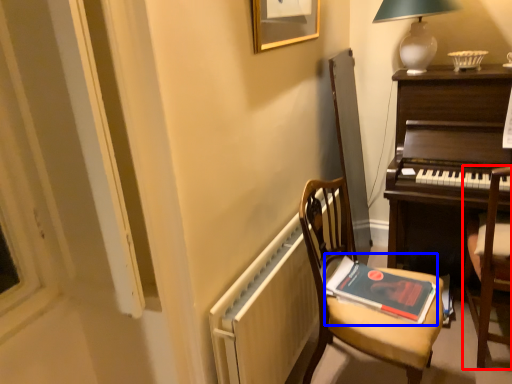
Question: Which object is closer to the camera taking this photo, chair (highlighted by a red box) or paperback book (highlighted by a blue box)?

Choices:
 (A) chair
 (B) paperback book

Answer: (A)